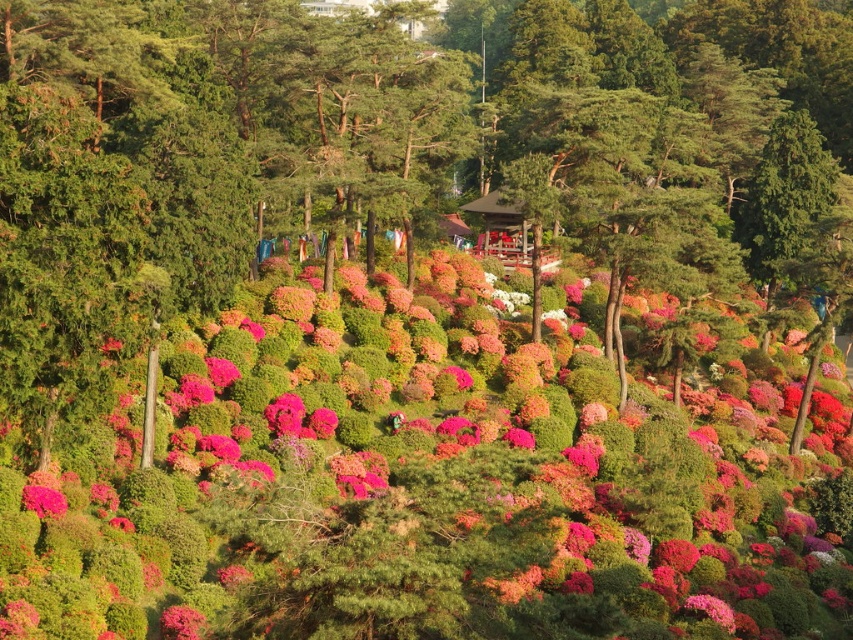
You are standing in the garden and want to take a photo that includes both the point at coordinates point [583,580] and point [178,609]. Which point should you focus on first to ensure both are in focus?

You should focus on point [583,580] first because it is closer to the camera than point [178,609], ensuring both points are within the depth of field.

You are standing at the entrance of the garden and want to locate the pink matte bush at center. According to the coordinates given, where should you look relative to the garden entrance?

The pink matte bush at center is located at coordinates point (437, 484), which is towards the center of the garden. Since you are at the entrance, you should look towards the central area of the garden to find it.

You are planning to place a small statue between the pink matte bush at center and the pink matte flower at lower left. Based on their positions, which object should the statue be closer to?

The statue should be placed closer to the pink matte flower at lower left because the pink matte bush at center is positioned on the right side of the pink matte flower at lower left, meaning the flower is to the left of the bush. Therefore, the statue between them would naturally be closer to the flower if placed near the flower.